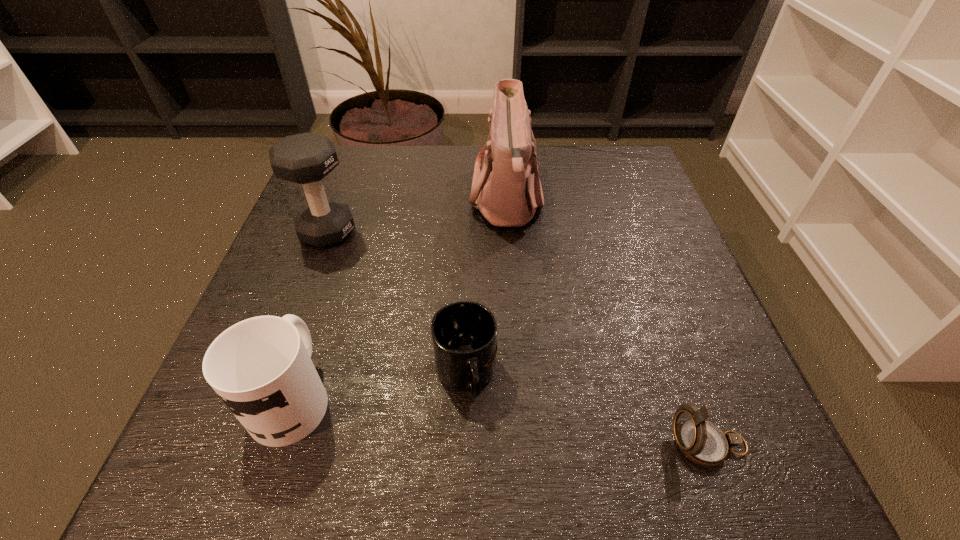
Locate which object is the closest to the compass. Please provide its 2D coordinates. Your answer should be formatted as a tuple, i.e. [(x, y)], where the tuple contains the x and y coordinates of a point satisfying the conditions above.

[(464, 334)]

At what (x,y) coordinates should I click in order to perform the action: click on the third closest object to the shorter mug. Please return your answer as a coordinate pair (x, y). This screenshot has height=540, width=960. Looking at the image, I should click on (702, 442).

At what (x,y) coordinates should I click in order to perform the action: click on vacant space that satisfies the following two spatial constraints: 1. on the front pocket of the shoulder bag; 2. with the handle on the side of the shorter mug. Please return your answer as a coordinate pair (x, y). Looking at the image, I should click on (518, 375).